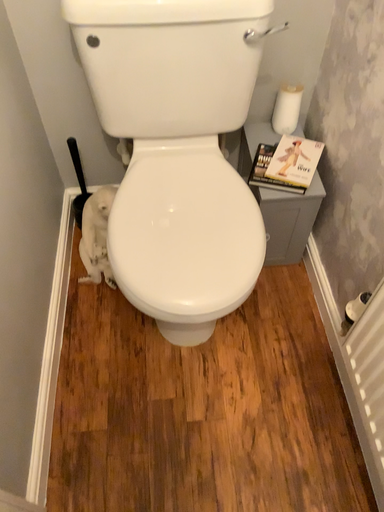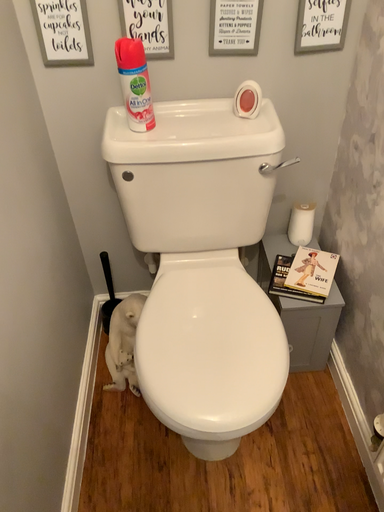
Question: How did the camera likely rotate when shooting the video?

Choices:
 (A) rotated upward
 (B) rotated downward

Answer: (A)